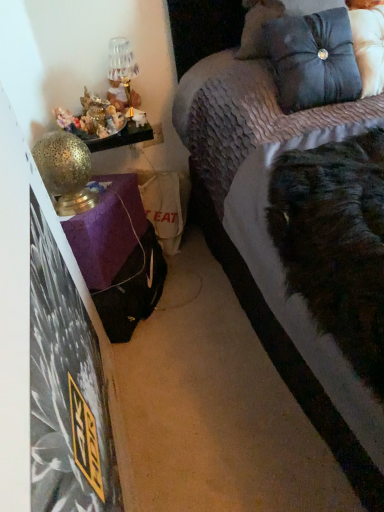
Question: Can you confirm if gold textured table lamp at left, arranged as the 2th table lamp when viewed from the top, is positioned to the right of velvet purple bed at upper right?

Choices:
 (A) yes
 (B) no

Answer: (B)

Question: From the image's perspective, is gold textured table lamp at left, which appears as the 1th table lamp when viewed from the front, on top of velvet purple bed at upper right?

Choices:
 (A) yes
 (B) no

Answer: (A)

Question: Could you tell me if gold textured table lamp at left, which appears as the 1th table lamp when viewed from the front, is turned towards velvet purple bed at upper right?

Choices:
 (A) yes
 (B) no

Answer: (B)

Question: Is gold textured table lamp at left, arranged as the 2th table lamp when viewed from the top, thinner than velvet purple bed at upper right?

Choices:
 (A) yes
 (B) no

Answer: (A)

Question: Does gold textured table lamp at left, which is counted as the first table lamp, starting from the bottom, have a smaller size compared to velvet purple bed at upper right?

Choices:
 (A) no
 (B) yes

Answer: (B)

Question: Is gold textured table lamp at left, arranged as the 2th table lamp when viewed from the top, located outside velvet purple bed at upper right?

Choices:
 (A) no
 (B) yes

Answer: (B)

Question: From the image's perspective, is velvet purple bed at upper right located beneath gold textured table lamp at left, arranged as the 2th table lamp when viewed from the top?

Choices:
 (A) no
 (B) yes

Answer: (B)

Question: Considering the relative sizes of velvet purple bed at upper right and gold textured table lamp at left, positioned as the 2th table lamp in back-to-front order, in the image provided, is velvet purple bed at upper right bigger than gold textured table lamp at left, positioned as the 2th table lamp in back-to-front order,?

Choices:
 (A) no
 (B) yes

Answer: (B)

Question: From a real-world perspective, is velvet purple bed at upper right positioned over gold textured table lamp at left, which appears as the 1th table lamp when viewed from the front, based on gravity?

Choices:
 (A) no
 (B) yes

Answer: (A)

Question: Would you consider velvet purple bed at upper right to be distant from gold textured table lamp at left, which is counted as the first table lamp, starting from the bottom?

Choices:
 (A) no
 (B) yes

Answer: (A)

Question: Does velvet purple bed at upper right have a smaller size compared to gold textured table lamp at left, arranged as the 2th table lamp when viewed from the top?

Choices:
 (A) yes
 (B) no

Answer: (B)

Question: Is velvet purple bed at upper right outside of gold textured table lamp at left, which appears as the 1th table lamp when viewed from the front?

Choices:
 (A) no
 (B) yes

Answer: (B)

Question: Can you confirm if shiny metallic figurines at left is taller than metallic gold table lamp at upper left, arranged as the first table lamp when viewed from the back?

Choices:
 (A) no
 (B) yes

Answer: (A)